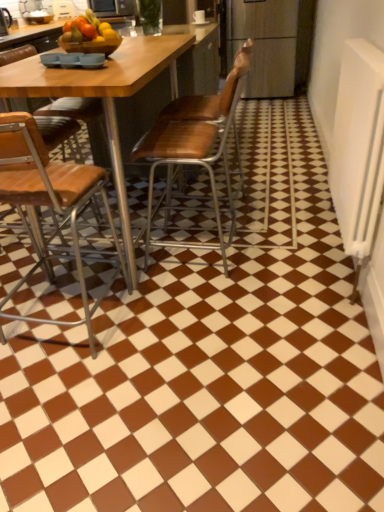
Question: From a real-world perspective, is brown leather chair at left, acting as the third chair starting from the right, over metallic microwave at upper center?

Choices:
 (A) no
 (B) yes

Answer: (A)

Question: Is brown leather chair at left, acting as the third chair starting from the right, shorter than metallic microwave at upper center?

Choices:
 (A) no
 (B) yes

Answer: (A)

Question: Is brown leather chair at left, positioned as the 1th chair in left-to-right order, in front of metallic microwave at upper center?

Choices:
 (A) no
 (B) yes

Answer: (B)

Question: Is brown leather chair at left, positioned as the 1th chair in left-to-right order, taller than metallic microwave at upper center?

Choices:
 (A) yes
 (B) no

Answer: (A)

Question: From the image's perspective, does brown leather chair at left, acting as the third chair starting from the right, appear higher than metallic microwave at upper center?

Choices:
 (A) yes
 (B) no

Answer: (B)

Question: Does brown leather chair at left, positioned as the 1th chair in left-to-right order, appear on the right side of metallic microwave at upper center?

Choices:
 (A) no
 (B) yes

Answer: (B)

Question: Does metallic microwave at upper center appear on the left side of wooden at center, which ranks as the second chair in left-to-right order?

Choices:
 (A) yes
 (B) no

Answer: (A)

Question: From a real-world perspective, is metallic microwave at upper center positioned over wooden at center, which ranks as the second chair in left-to-right order, based on gravity?

Choices:
 (A) no
 (B) yes

Answer: (B)

Question: Can you confirm if metallic microwave at upper center is positioned to the right of wooden at center, the 2th chair from the right?

Choices:
 (A) yes
 (B) no

Answer: (B)

Question: Does metallic microwave at upper center turn towards wooden at center, the 2th chair from the right?

Choices:
 (A) no
 (B) yes

Answer: (B)

Question: Is metallic microwave at upper center looking in the opposite direction of wooden at center, the 2th chair from the right?

Choices:
 (A) yes
 (B) no

Answer: (B)

Question: Does metallic microwave at upper center have a smaller size compared to wooden at center, the 2th chair from the right?

Choices:
 (A) no
 (B) yes

Answer: (B)

Question: Considering the relative sizes of metallic microwave at upper center and brown leather chair at left, acting as the third chair starting from the right, in the image provided, is metallic microwave at upper center smaller than brown leather chair at left, acting as the third chair starting from the right,?

Choices:
 (A) no
 (B) yes

Answer: (B)